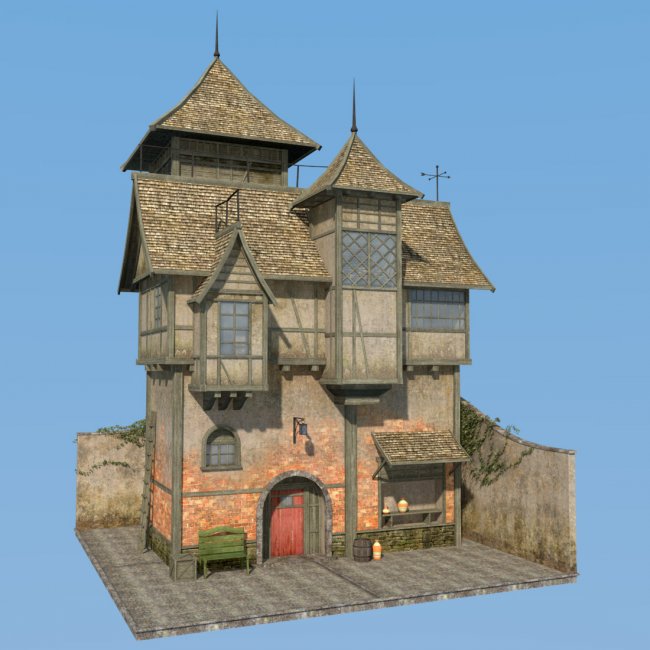
The width and height of the screenshot is (650, 650). In order to click on windowpane in this screenshot , I will do `click(235, 341)`.